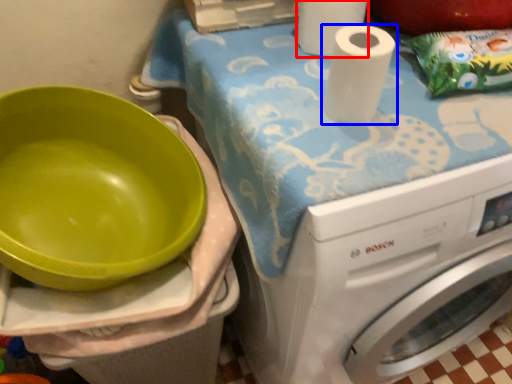
Question: Which object appears closest to the camera in this image, paper towel (highlighted by a red box) or paper towel (highlighted by a blue box)?

Choices:
 (A) paper towel
 (B) paper towel

Answer: (B)